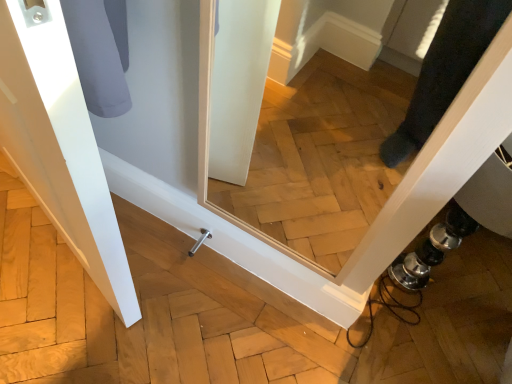
Identify the location of free space underneath white matte door at left (from a real-world perspective). Image resolution: width=512 pixels, height=384 pixels. (52, 247).